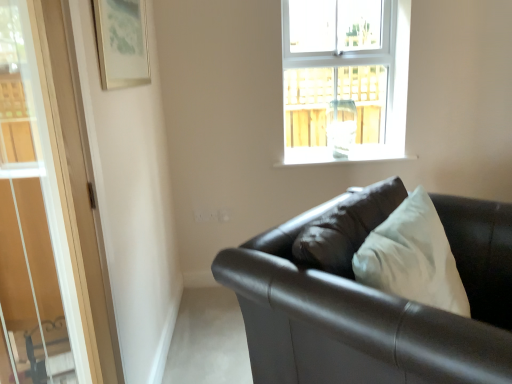
Question: From the image's perspective, is clear glass window at upper center above or below white smooth window sill at upper center?

Choices:
 (A) below
 (B) above

Answer: (B)

Question: Choose the correct answer: Is clear glass window at upper center inside white smooth window sill at upper center or outside it?

Choices:
 (A) outside
 (B) inside

Answer: (A)

Question: Based on their relative distances, which object is farther from the white smooth window sill at upper center?

Choices:
 (A) matte black couch at lower right
 (B) transparent glass door at left
 (C) metallic silver picture frame at upper left
 (D) clear glass window at upper center

Answer: (B)

Question: Considering the real-world distances, which object is closest to the transparent glass door at left?

Choices:
 (A) clear glass window at upper center
 (B) matte black couch at lower right
 (C) white smooth window sill at upper center
 (D) metallic silver picture frame at upper left

Answer: (D)